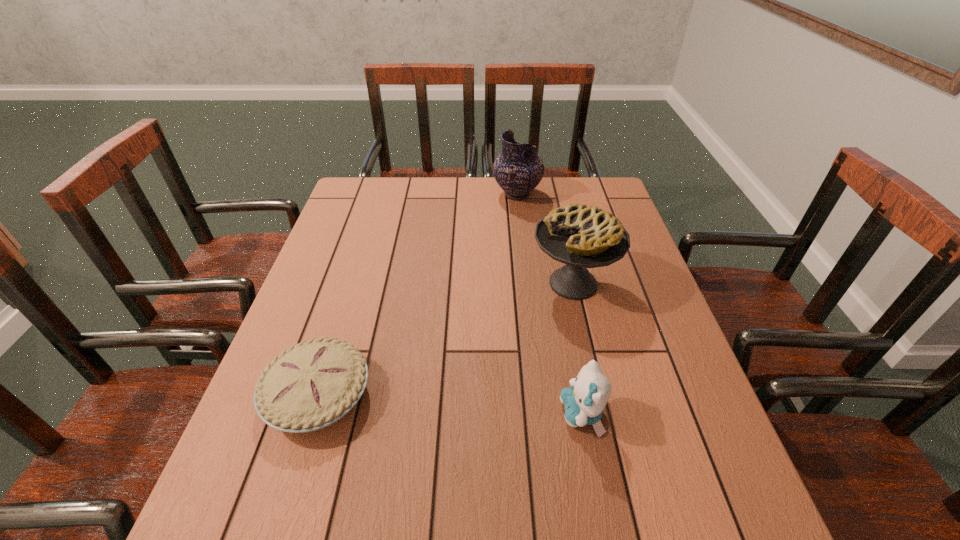
Identify the location of free spot located 0.280m on the face of the third tallest object. The height and width of the screenshot is (540, 960). (421, 414).

Image resolution: width=960 pixels, height=540 pixels. I want to click on vacant area located on the face of the third tallest object, so pyautogui.click(x=466, y=414).

Locate an element on the screen. The height and width of the screenshot is (540, 960). free spot located on the face of the third tallest object is located at coordinates (486, 414).

Locate an element on the screen. The height and width of the screenshot is (540, 960). vacant space located 0.260m on the right of the leftmost object is located at coordinates (495, 395).

You are a GUI agent. You are given a task and a screenshot of the screen. Output one action in this format:
    pyautogui.click(x=<x>, y=<y>)
    Task: Click on the object present at the far edge
    The height and width of the screenshot is (540, 960).
    Given the screenshot: What is the action you would take?
    pyautogui.click(x=518, y=170)

Image resolution: width=960 pixels, height=540 pixels. What are the coordinates of `object present at the left edge` in the screenshot? It's located at (x=312, y=385).

The image size is (960, 540). I want to click on object present at the right edge, so click(580, 236).

At what (x,y) coordinates should I click in order to perform the action: click on free space at the far edge of the desktop. Please return your answer as a coordinate pair (x, y). Looking at the image, I should click on click(454, 211).

I want to click on vacant area at the near edge, so click(x=501, y=522).

At what (x,y) coordinates should I click in order to perform the action: click on free location at the right edge. Please return your answer as a coordinate pair (x, y). Looking at the image, I should click on (704, 396).